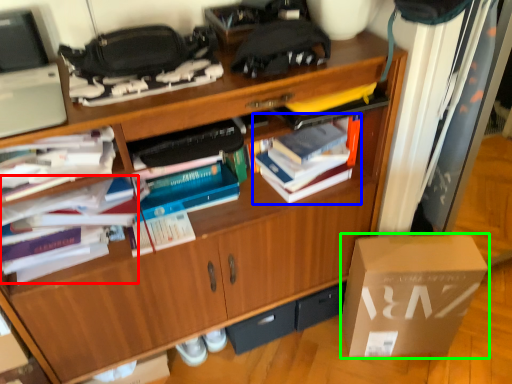
Question: Based on their relative distances, which object is nearer to book (highlighted by a red box)? Choose from book (highlighted by a blue box) and box (highlighted by a green box).

Choices:
 (A) book
 (B) box

Answer: (A)